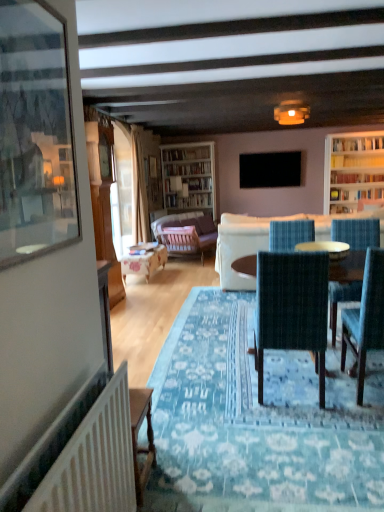
Question: Considering the relative sizes of white textured radiator at lower left and dark green fabric chair at center, the 1th chair positioned from the left, in the image provided, is white textured radiator at lower left smaller than dark green fabric chair at center, the 1th chair positioned from the left,?

Choices:
 (A) yes
 (B) no

Answer: (A)

Question: From a real-world perspective, does white textured radiator at lower left stand above dark green fabric chair at center, the 1th chair positioned from the left?

Choices:
 (A) no
 (B) yes

Answer: (A)

Question: Considering the relative positions of white textured radiator at lower left and dark green fabric chair at center, the 1th chair positioned from the left, in the image provided, is white textured radiator at lower left behind dark green fabric chair at center, the 1th chair positioned from the left,?

Choices:
 (A) yes
 (B) no

Answer: (B)

Question: From a real-world perspective, is white textured radiator at lower left located beneath dark green fabric chair at center, placed as the second chair when sorted from right to left?

Choices:
 (A) no
 (B) yes

Answer: (B)

Question: Is white textured radiator at lower left oriented towards dark green fabric chair at center, the 1th chair positioned from the left?

Choices:
 (A) yes
 (B) no

Answer: (B)

Question: Does white textured radiator at lower left lie in front of dark green fabric chair at center, the 1th chair positioned from the left?

Choices:
 (A) yes
 (B) no

Answer: (A)

Question: From the image's perspective, is wooden table at center on black matte television at upper center?

Choices:
 (A) yes
 (B) no

Answer: (B)

Question: Is wooden table at center closer to the viewer compared to black matte television at upper center?

Choices:
 (A) no
 (B) yes

Answer: (B)

Question: Are wooden table at center and black matte television at upper center far apart?

Choices:
 (A) yes
 (B) no

Answer: (A)

Question: From a real-world perspective, is wooden table at center located beneath black matte television at upper center?

Choices:
 (A) yes
 (B) no

Answer: (A)

Question: Does wooden table at center have a larger size compared to black matte television at upper center?

Choices:
 (A) yes
 (B) no

Answer: (A)

Question: From the image's perspective, is wooden table at center located beneath black matte television at upper center?

Choices:
 (A) no
 (B) yes

Answer: (B)

Question: Does velvet purple couch at center, the second studio couch positioned from the front, touch matte yellow lampshade at upper center?

Choices:
 (A) yes
 (B) no

Answer: (B)